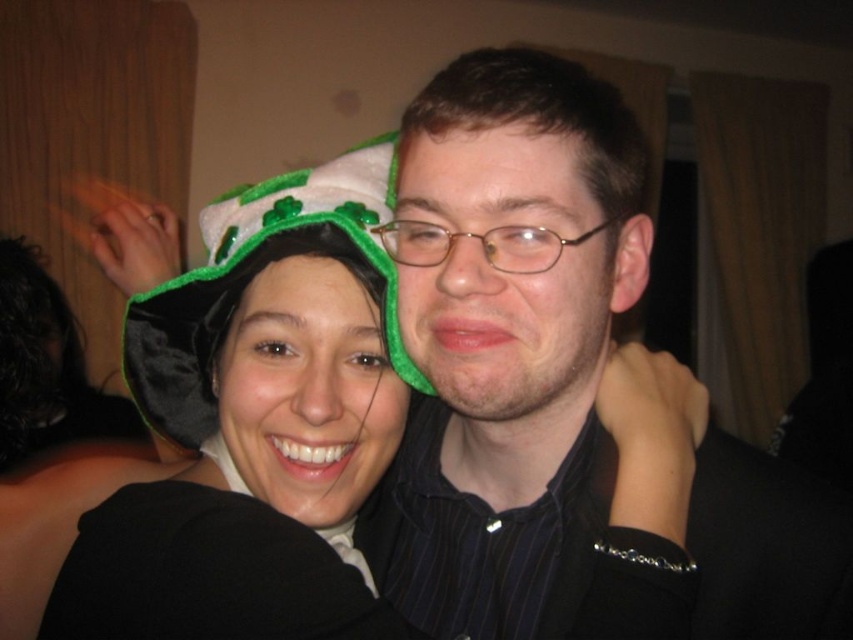
You are a photographer at a St. Patrick Day party and need to adjust the lighting so that the taller object among the velvet hat at center and the velvet green hat at center is properly illuminated. Which hat should you focus the light on?

The velvet hat at center is taller than the velvet green hat at center, so you should focus the light on the velvet hat at center to ensure proper illumination.

You are at a St. Patrick Day party and see two hats. One is a velvet hat at center and the other is a velvet green hat at center. Which hat is positioned to the right of the other?

The velvet hat at center is positioned to the right of the velvet green hat at center.

Where is the velvet hat at center located in the image?

The velvet hat at center is located at point coordinates of [257,428].